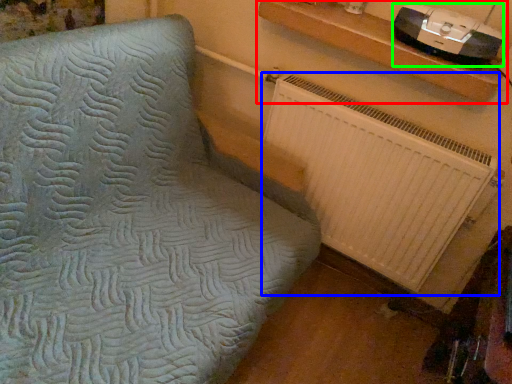
Question: Based on their relative distances, which object is farther from shelf (highlighted by a red box)? Choose from radiator (highlighted by a blue box) and stereo (highlighted by a green box).

Choices:
 (A) radiator
 (B) stereo

Answer: (A)